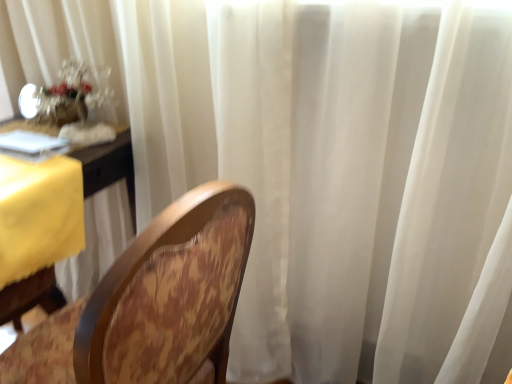
Question: Does wooden chair at center have a larger size compared to translucent glass floral arrangement at upper left?

Choices:
 (A) no
 (B) yes

Answer: (B)

Question: Does wooden chair at center appear on the left side of translucent glass floral arrangement at upper left?

Choices:
 (A) yes
 (B) no

Answer: (B)

Question: Does wooden chair at center have a lesser height compared to translucent glass floral arrangement at upper left?

Choices:
 (A) no
 (B) yes

Answer: (A)

Question: Is wooden chair at center looking in the opposite direction of translucent glass floral arrangement at upper left?

Choices:
 (A) no
 (B) yes

Answer: (A)

Question: Could translucent glass floral arrangement at upper left be considered to be inside wooden chair at center?

Choices:
 (A) no
 (B) yes

Answer: (A)

Question: From a real-world perspective, is wooden chair at center positioned under translucent glass floral arrangement at upper left based on gravity?

Choices:
 (A) yes
 (B) no

Answer: (A)

Question: Considering the relative sizes of translucent glass floral arrangement at upper left and wooden chair at center in the image provided, is translucent glass floral arrangement at upper left thinner than wooden chair at center?

Choices:
 (A) yes
 (B) no

Answer: (A)

Question: Is translucent glass floral arrangement at upper left not inside wooden chair at center?

Choices:
 (A) yes
 (B) no

Answer: (A)

Question: From a real-world perspective, is translucent glass floral arrangement at upper left on top of wooden chair at center?

Choices:
 (A) no
 (B) yes

Answer: (B)

Question: From a real-world perspective, is translucent glass floral arrangement at upper left beneath wooden chair at center?

Choices:
 (A) no
 (B) yes

Answer: (A)

Question: From the image's perspective, is translucent glass floral arrangement at upper left above wooden chair at center?

Choices:
 (A) no
 (B) yes

Answer: (B)

Question: Is translucent glass floral arrangement at upper left closer to camera compared to wooden chair at center?

Choices:
 (A) yes
 (B) no

Answer: (B)

Question: Would you consider translucent glass floral arrangement at upper left to be distant from yellow fabric table at left?

Choices:
 (A) yes
 (B) no

Answer: (B)